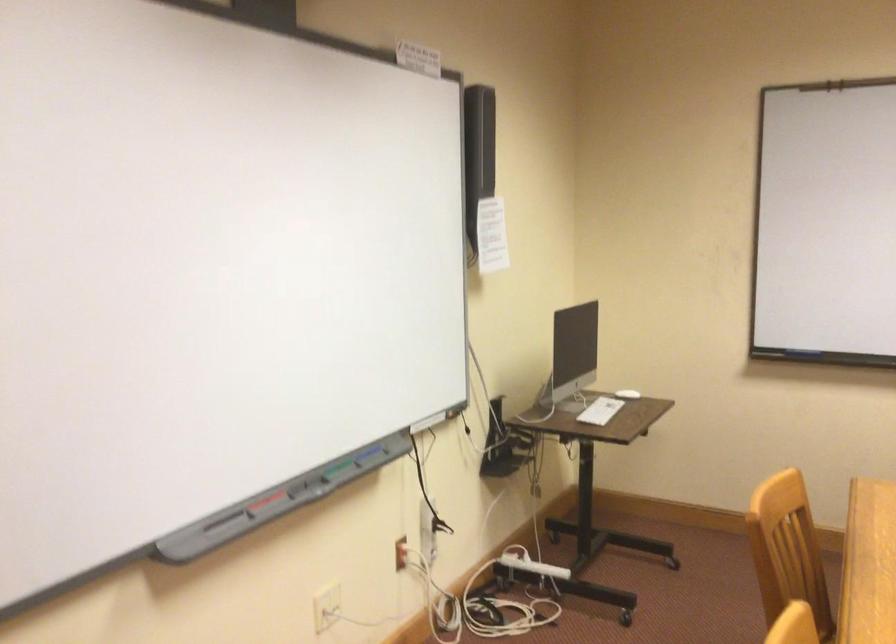
This screenshot has width=896, height=644. I want to click on green whiteboard marker, so click(x=333, y=468).